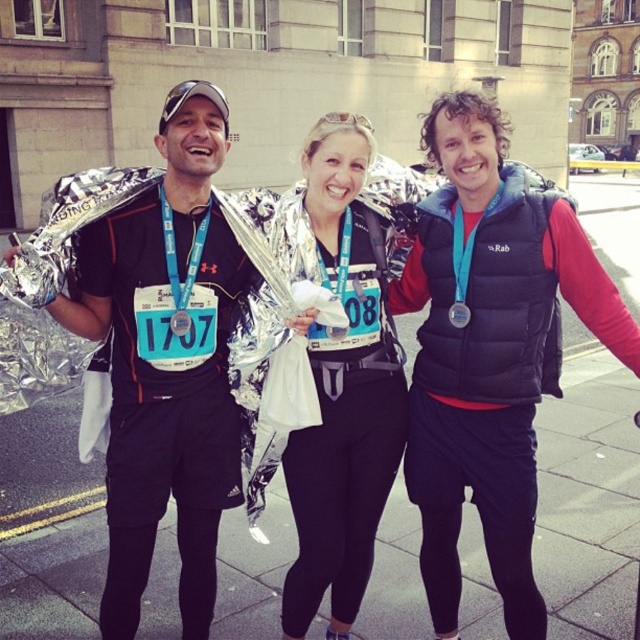
Is black puffer vest at center positioned at the back of matte black jacket at center?

Yes, black puffer vest at center is further from the viewer.

Which is more to the right, black puffer vest at center or matte black jacket at center?

black puffer vest at center

This screenshot has height=640, width=640. Find the location of `black puffer vest at center`. black puffer vest at center is located at coordinates (490, 349).

Is black puffer vest at center further to camera compared to matte silver foil at center?

No, it is in front of matte silver foil at center.

Between point (412, 483) and point (346, 257), which one is positioned in front?

Point (346, 257) is in front.

Who is more forward, (516, 576) or (349, 467)?

Point (516, 576)

Locate an element on the screen. The image size is (640, 640). black puffer vest at center is located at coordinates (490, 349).

In the scene shown: Is matte black jacket at center smaller than matte silver foil at center?

No.

Between matte black jacket at center and matte silver foil at center, which one has more height?

matte black jacket at center is taller.

Is point (106, 509) positioned before point (324, 122)?

That is False.

The image size is (640, 640). In order to click on matte black jacket at center in this screenshot , I will do `click(166, 362)`.